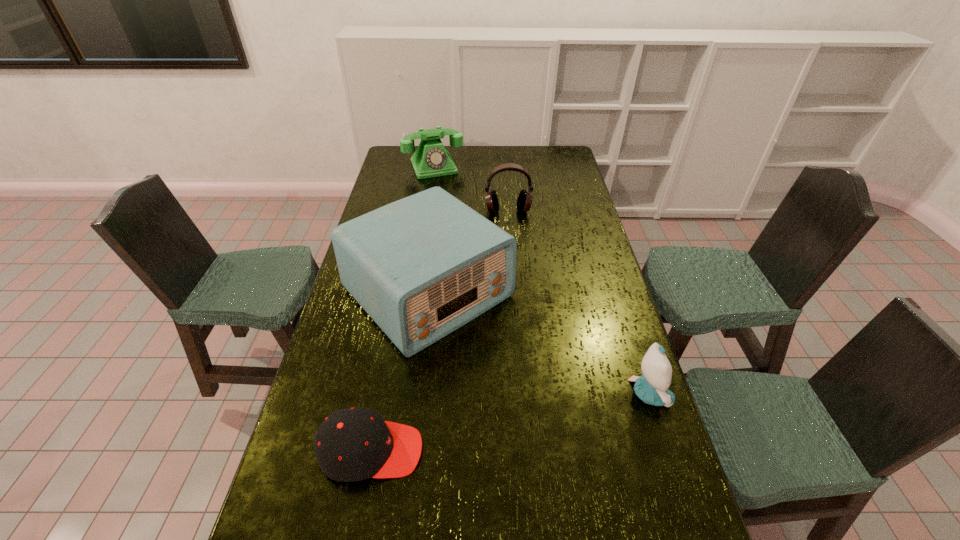
Identify the location of free space located on the front panel of the tallest object. This screenshot has height=540, width=960. (499, 357).

Image resolution: width=960 pixels, height=540 pixels. I want to click on blank space located on the front panel of the tallest object, so click(x=523, y=380).

Find the location of a particular element. Image resolution: width=960 pixels, height=540 pixels. vacant space located 0.190m on the dial of the farthest object is located at coordinates (450, 199).

Where is `free space located on the dial of the farthest object`? The image size is (960, 540). free space located on the dial of the farthest object is located at coordinates (457, 214).

This screenshot has height=540, width=960. Find the location of `free region located on the dial of the farthest object`. free region located on the dial of the farthest object is located at coordinates (455, 209).

Where is `free space located 0.060m on the ear pads of the fourth nearest object`? free space located 0.060m on the ear pads of the fourth nearest object is located at coordinates (510, 226).

At what (x,y) coordinates should I click in order to perform the action: click on vacant space located on the ear pads of the fourth nearest object. Please return your answer as a coordinate pair (x, y). Looking at the image, I should click on (512, 244).

Identify the location of free location located on the ear pads of the fourth nearest object. Image resolution: width=960 pixels, height=540 pixels. (511, 232).

This screenshot has width=960, height=540. What are the coordinates of `object that is at the far edge` in the screenshot? It's located at (431, 159).

This screenshot has width=960, height=540. What are the coordinates of `object present at the near edge` in the screenshot? It's located at (352, 444).